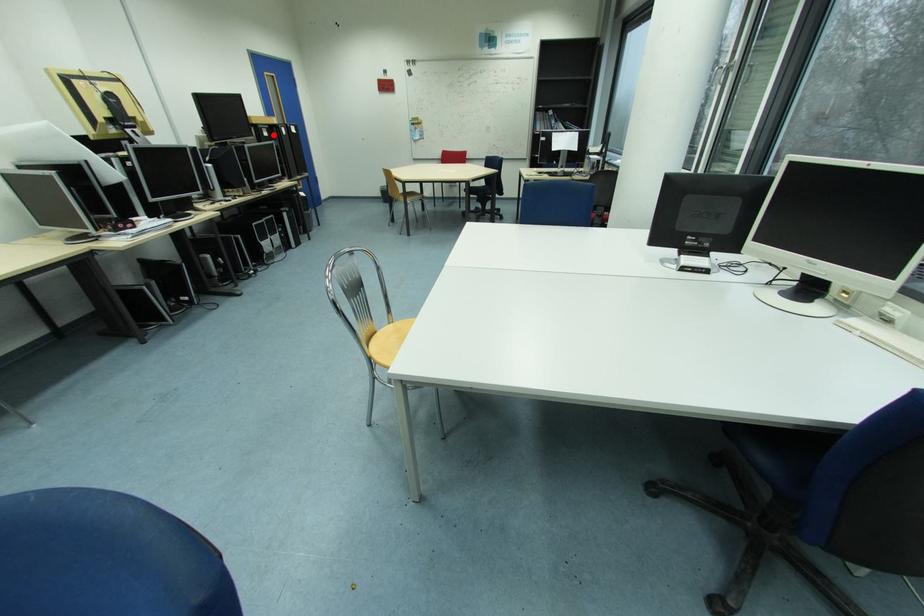
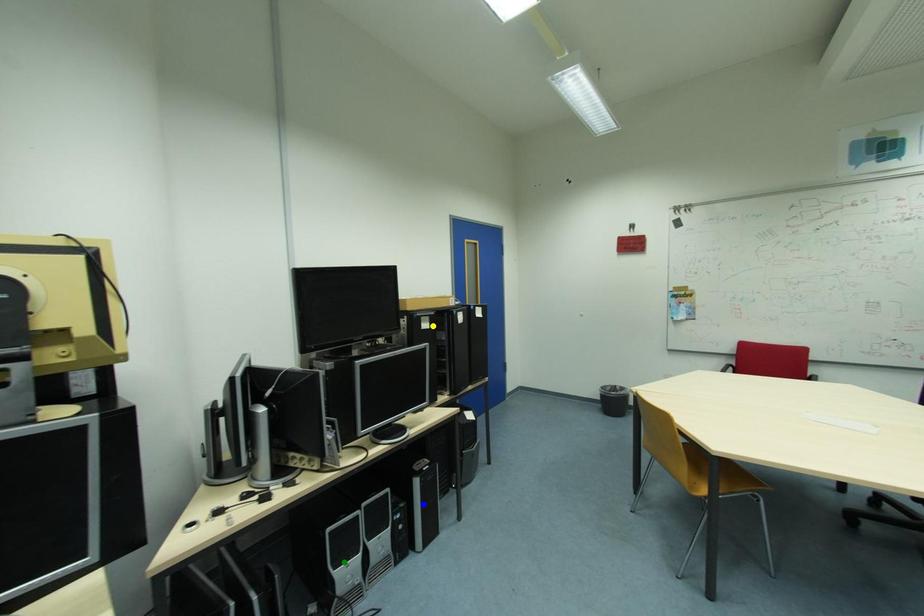
Question: I am providing you with two images of the same scene from different viewpoints. A red point is marked on the first image. You are given multiple points on the second image. Which point in image 2 represents the same 3d spot as the red point in image 1?

Choices:
 (A) yellow point
 (B) blue point
 (C) green point

Answer: (A)